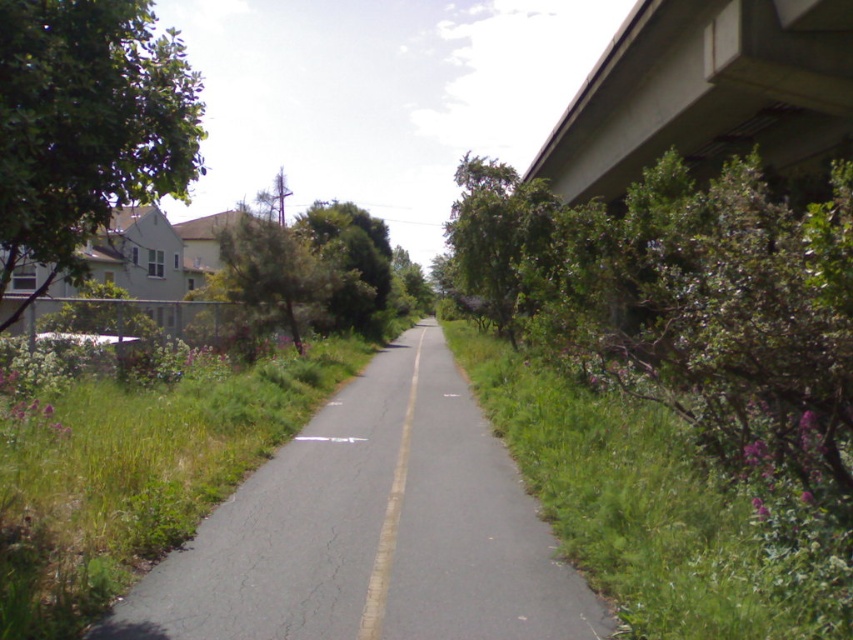
Between point (595, 560) and point (115, 36), which one is positioned behind?

The point (595, 560) is behind.

Is green grass at right to the left of green leafy tree at left from the viewer's perspective?

In fact, green grass at right is to the right of green leafy tree at left.

This screenshot has height=640, width=853. I want to click on green grass at right, so click(640, 506).

The height and width of the screenshot is (640, 853). I want to click on green grass at right, so click(640, 506).

Between green grass at lower left and green leafy tree at left, which one appears on the left side from the viewer's perspective?

Positioned to the left is green leafy tree at left.

Is point (169, 490) less distant than point (135, 29)?

No, (169, 490) is further to viewer.

Where is `green grass at lower left`? The image size is (853, 640). green grass at lower left is located at coordinates (135, 476).

Who is more distant from viewer, (714, 298) or (590, 499)?

Point (590, 499)

At what (x,y) coordinates should I click in order to perform the action: click on green leafy bush at right. Please return your answer as a coordinate pair (x, y). This screenshot has width=853, height=640. Looking at the image, I should click on (688, 308).

Identify the location of green leafy bush at right. (688, 308).